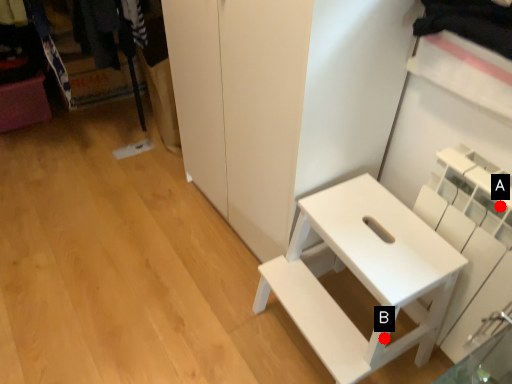
Question: Two points are circled on the image, labeled by A and B beside each circle. Among these points, which one is farthest from the camera?

Choices:
 (A) A is further
 (B) B is further

Answer: (B)